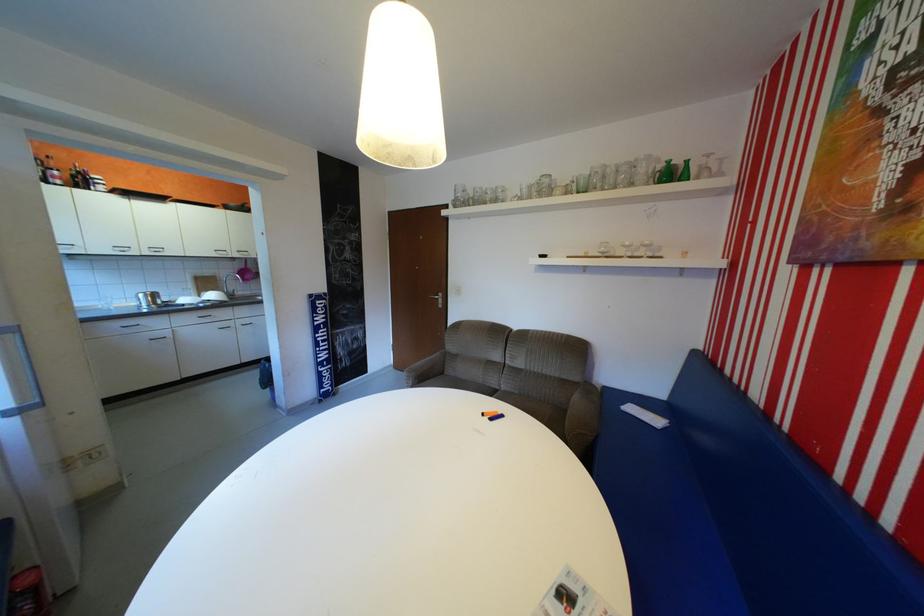
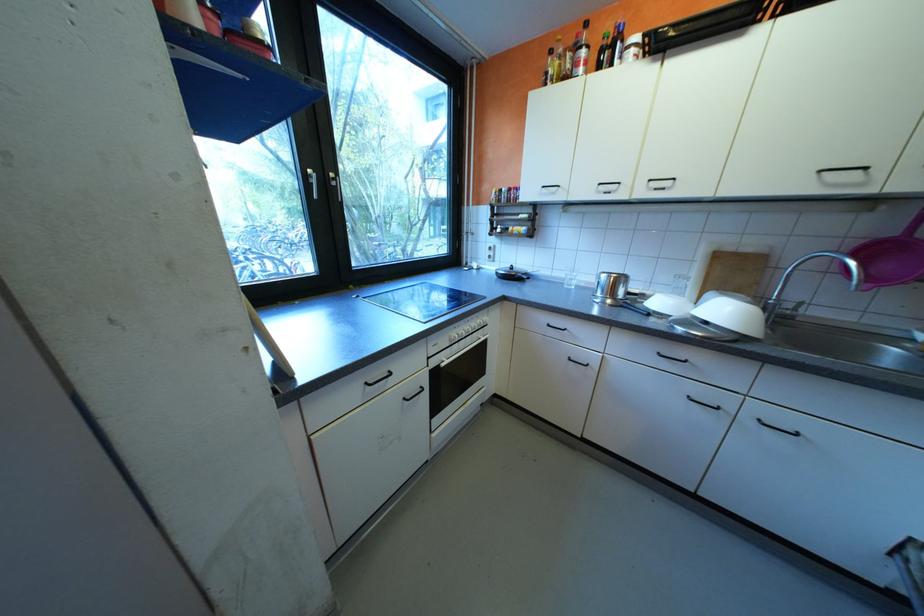
Find the pixel in the second image that matches [242,294] in the first image.

(791, 317)